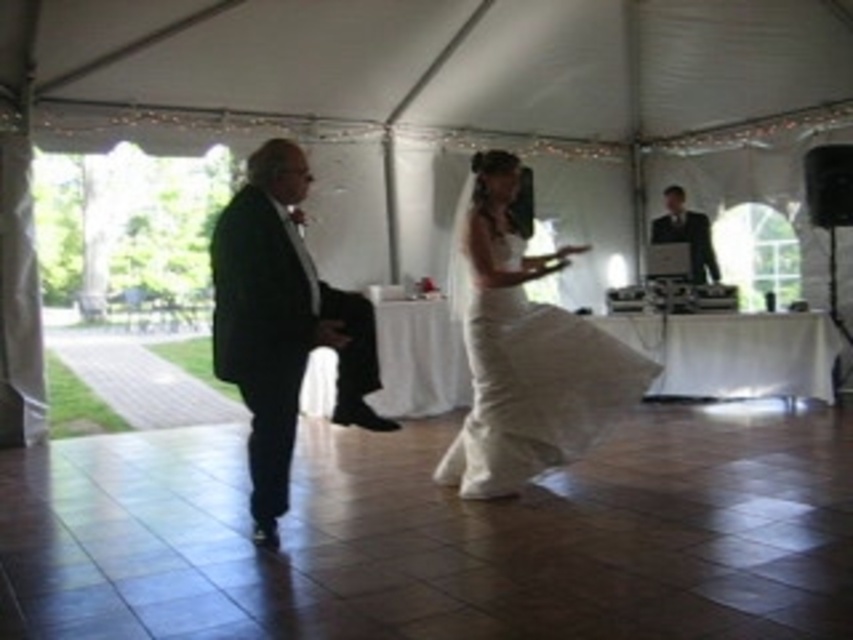
You are standing at the entrance of the tented venue and see the matte black suit at left. If you want to walk directly towards it, which direction should you move relative to your current position?

To walk directly towards the matte black suit at left, you should move towards the coordinates point (527, 356).